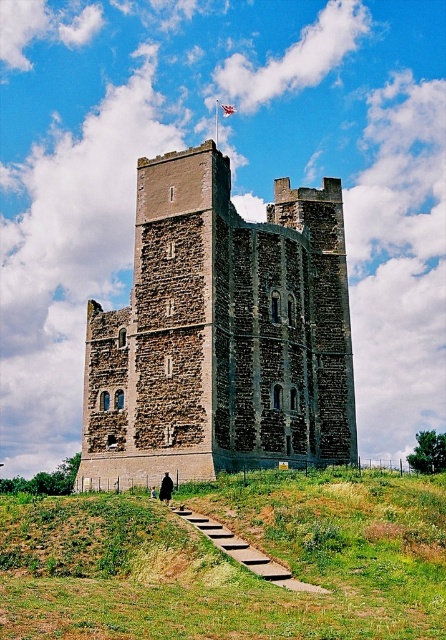
Which of these two, brown stone tower at center or wooden steps at lower center, stands shorter?

wooden steps at lower center is shorter.

Who is taller, brown stone tower at center or wooden steps at lower center?

brown stone tower at center is taller.

The image size is (446, 640). What do you see at coordinates (222, 332) in the screenshot?
I see `brown stone tower at center` at bounding box center [222, 332].

At what (x,y) coordinates should I click in order to perform the action: click on brown stone tower at center. Please return your answer as a coordinate pair (x, y). Looking at the image, I should click on (222, 332).

Is the position of wooden steps at lower center less distant than that of white fabric flag at upper center?

That is True.

Is wooden steps at lower center above white fabric flag at upper center?

Actually, wooden steps at lower center is below white fabric flag at upper center.

The image size is (446, 640). What do you see at coordinates (238, 548) in the screenshot?
I see `wooden steps at lower center` at bounding box center [238, 548].

This screenshot has height=640, width=446. Find the location of `wooden steps at lower center`. wooden steps at lower center is located at coordinates (238, 548).

Which of these two, brown stone tower at center or green grassy at lower center, stands taller?

With more height is brown stone tower at center.

Between point (247, 440) and point (248, 612), which one is positioned behind?

Positioned behind is point (247, 440).

Identify the location of brown stone tower at center. Image resolution: width=446 pixels, height=640 pixels. (222, 332).